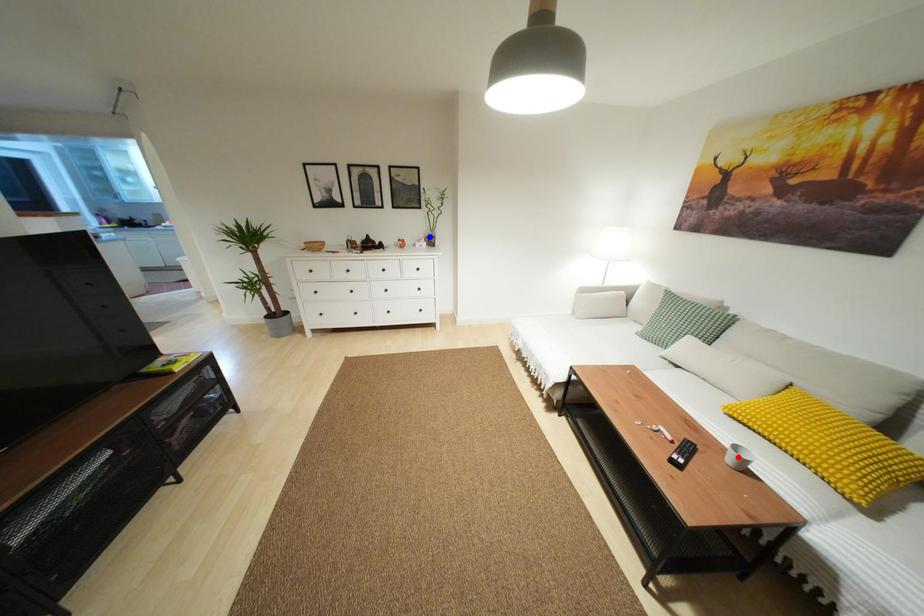
Question: In the image, two points are highlighted. Which point is nearer to the camera? Reply with the corresponding letter.

Choices:
 (A) blue point
 (B) red point

Answer: (B)